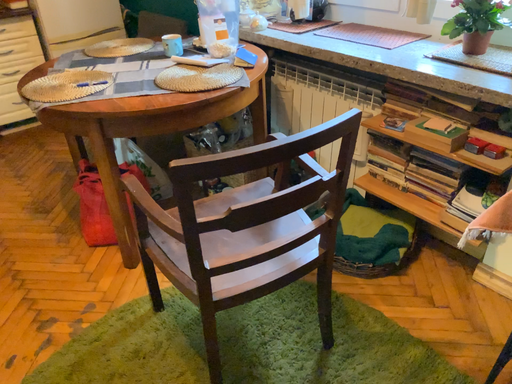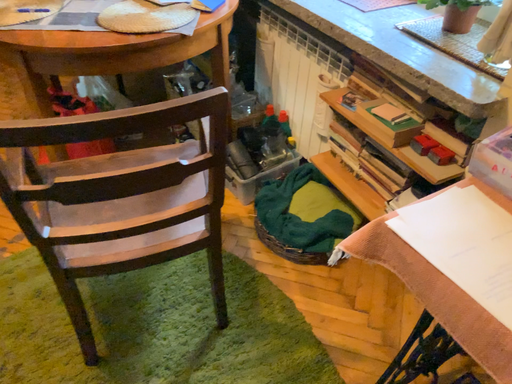
Question: How did the camera likely rotate when shooting the video?

Choices:
 (A) rotated right
 (B) rotated left

Answer: (B)